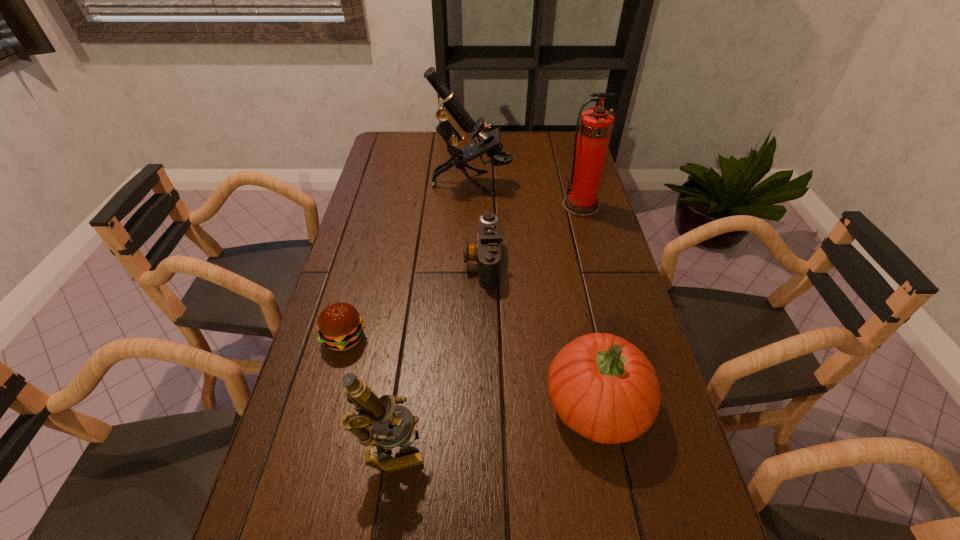
Locate an element on the screen. The height and width of the screenshot is (540, 960). free location located 0.080m on the back of the fourth shortest object is located at coordinates (400, 393).

Locate an element on the screen. This screenshot has height=540, width=960. blank space located on the back of the pumpkin is located at coordinates (573, 288).

You are a GUI agent. You are given a task and a screenshot of the screen. Output one action in this format:
    pyautogui.click(x=<x>, y=<y>)
    Task: Click on the vacant space located 0.130m on the lens of the third farthest object
    This screenshot has height=540, width=960.
    Given the screenshot: What is the action you would take?
    pyautogui.click(x=420, y=261)

The width and height of the screenshot is (960, 540). Find the location of `free location located 0.060m on the lens of the third farthest object`. free location located 0.060m on the lens of the third farthest object is located at coordinates (444, 261).

This screenshot has height=540, width=960. What are the coordinates of `free space located 0.210m on the lens of the third farthest object` in the screenshot? It's located at (393, 261).

This screenshot has height=540, width=960. I want to click on vacant space located 0.310m on the front of the leftmost object, so click(302, 494).

Find the location of a particular element. This screenshot has width=960, height=540. microscope at the left edge is located at coordinates (375, 413).

Where is `hamburger that is at the left edge`? This screenshot has width=960, height=540. hamburger that is at the left edge is located at coordinates (340, 326).

Locate an element on the screen. The image size is (960, 540). fire extinguisher that is at the right edge is located at coordinates (590, 149).

Identify the location of pumpkin that is at the right edge. (603, 387).